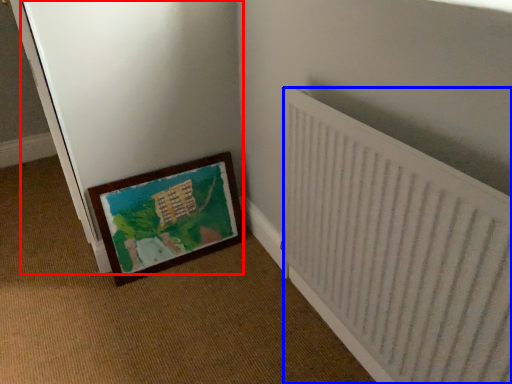
Question: Which object is further to the camera taking this photo, screen door (highlighted by a red box) or radiator (highlighted by a blue box)?

Choices:
 (A) screen door
 (B) radiator

Answer: (A)